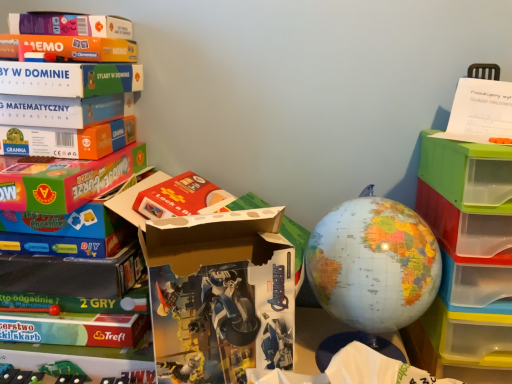
Question: Choose the correct answer: Is white paper at upper right inside translucent plastic drawers at right or outside it?

Choices:
 (A) inside
 (B) outside

Answer: (B)

Question: From a real-world perspective, is white paper at upper right above or below translucent plastic drawers at right?

Choices:
 (A) below
 (B) above

Answer: (B)

Question: Based on their relative distances, which object is farther from the white paper at upper right?

Choices:
 (A) matte plastic globe at center
 (B) translucent plastic drawers at right
 (C) white cardboard box at center

Answer: (C)

Question: Which of these objects is positioned closest to the matte plastic globe at center?

Choices:
 (A) translucent plastic drawers at right
 (B) white paper at upper right
 (C) white cardboard box at center

Answer: (A)